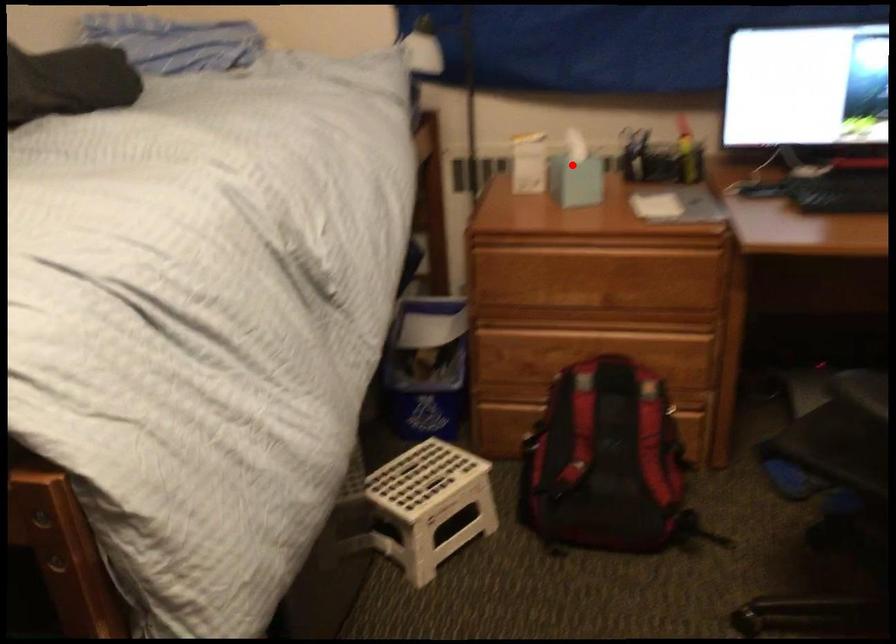
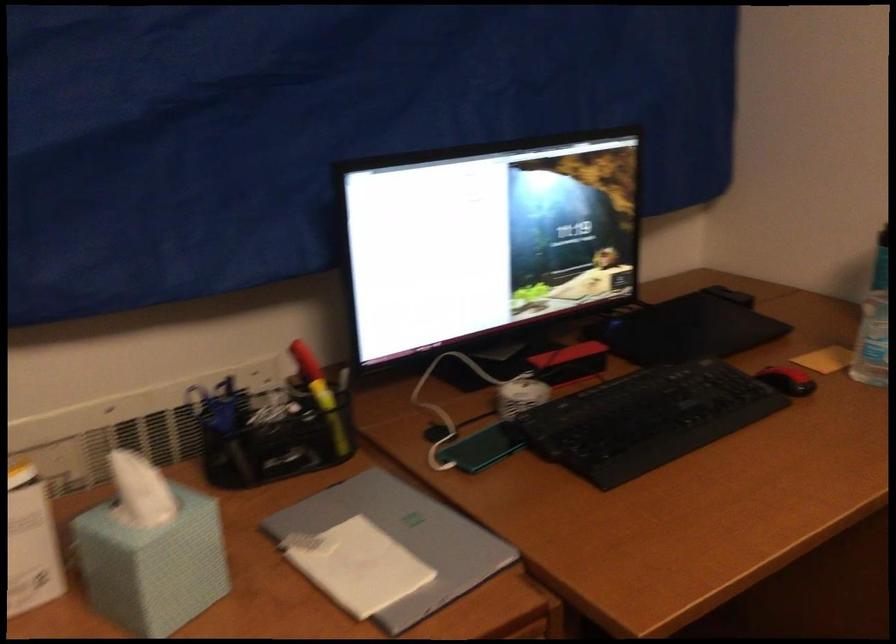
Question: I am providing you with two images of the same scene from different viewpoints. A red point is shown in image1. For the corresponding object point in image2, is it positioned nearer or farther from the camera?

Choices:
 (A) Nearer
 (B) Farther

Answer: (A)